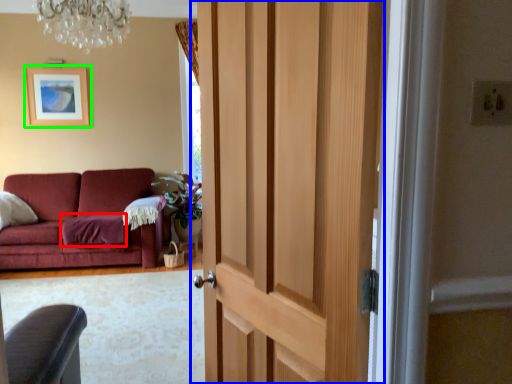
Question: Which object is positioned farthest from blanket (highlighted by a red box)? Select from door (highlighted by a blue box) and picture frame (highlighted by a green box).

Choices:
 (A) door
 (B) picture frame

Answer: (A)